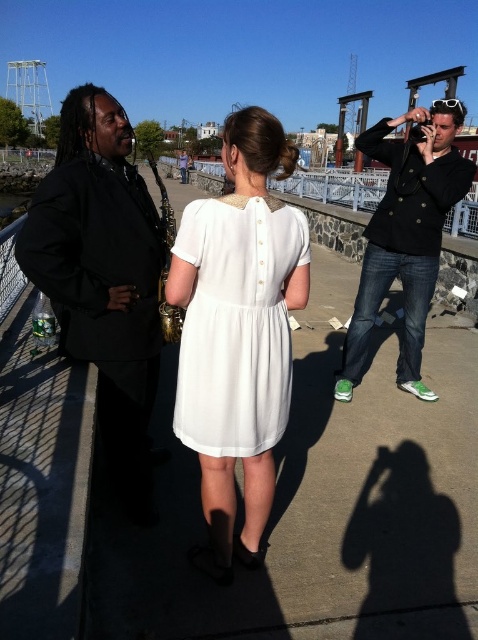
The height and width of the screenshot is (640, 478). I want to click on black matte suit at left, so click(102, 276).

Does black matte suit at left have a lesser height compared to black leather jacket at right?

Incorrect, black matte suit at left's height does not fall short of black leather jacket at right's.

Is point (137, 452) farther from viewer compared to point (382, 246)?

No, it is in front of (382, 246).

Image resolution: width=478 pixels, height=640 pixels. What are the coordinates of `black matte suit at left` in the screenshot? It's located at (102, 276).

At what (x,y) coordinates should I click in order to perform the action: click on white satin dress at center. Please return your answer as a coordinate pair (x, y). Looking at the image, I should click on (237, 323).

Is white satin dress at center above black leather jacket at right?

Indeed, white satin dress at center is positioned over black leather jacket at right.

At what (x,y) coordinates should I click in order to perform the action: click on white satin dress at center. Please return your answer as a coordinate pair (x, y). This screenshot has height=640, width=478. Looking at the image, I should click on pos(237,323).

Which of these two, black matte suit at left or white satin dress at center, stands shorter?

white satin dress at center is shorter.

Is point (138, 269) farther from camera compared to point (183, 332)?

Yes, it is behind point (183, 332).

Locate an element on the screen. This screenshot has width=478, height=640. black matte suit at left is located at coordinates (102, 276).